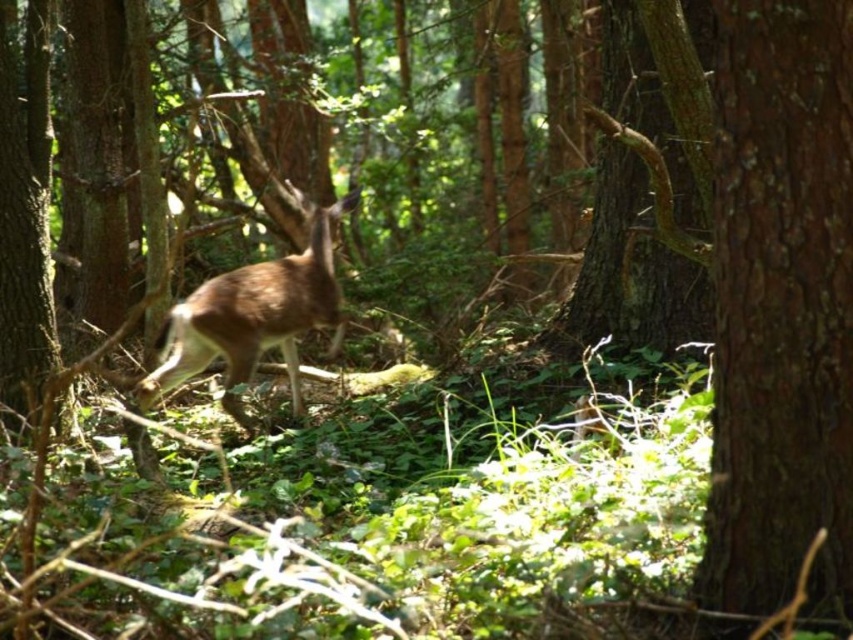
From the picture: Is brown rough bark tree at center right below brown matte/deer at center?

Actually, brown rough bark tree at center right is above brown matte/deer at center.

Looking at this image, how much distance is there between brown rough bark tree at center right and brown matte/deer at center?

They are 3.99 meters apart.

The width and height of the screenshot is (853, 640). What do you see at coordinates (781, 307) in the screenshot? I see `brown rough bark tree at center right` at bounding box center [781, 307].

At what (x,y) coordinates should I click in order to perform the action: click on brown rough bark tree at center right. Please return your answer as a coordinate pair (x, y). Looking at the image, I should click on (781, 307).